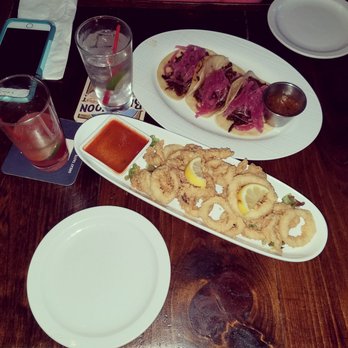
Where is `wooden table`? wooden table is located at coordinates (226, 282).